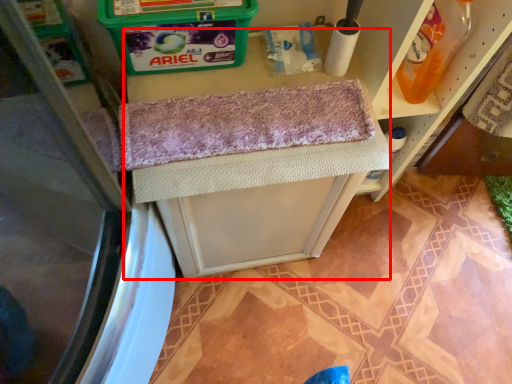
Question: From the image's perspective, where is vanity (annotated by the red box) located relative to cleaning product?

Choices:
 (A) below
 (B) above

Answer: (A)